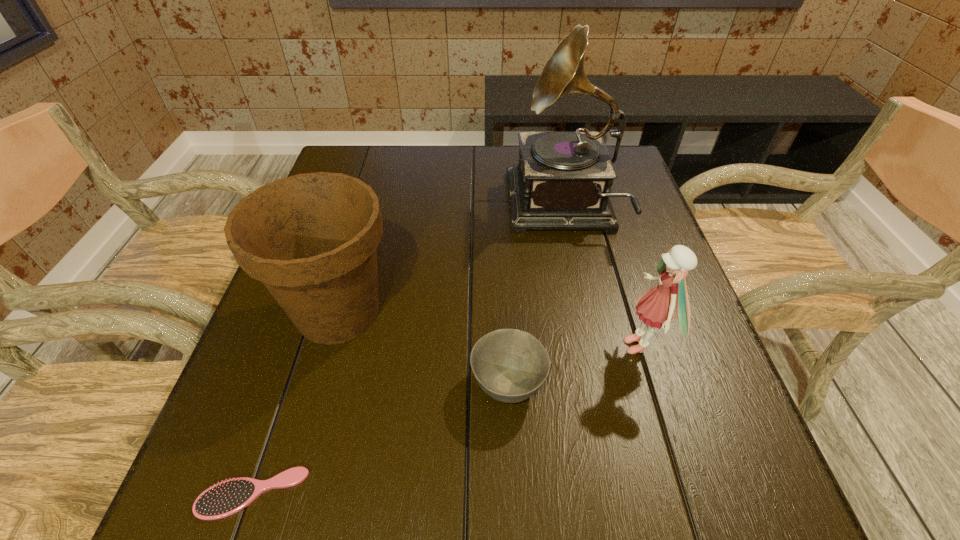
I want to click on record player at the right edge, so click(x=563, y=181).

Locate an element on the screen. This screenshot has width=960, height=540. doll situated at the right edge is located at coordinates (657, 306).

Identify the location of object at the near left corner. The height and width of the screenshot is (540, 960). (228, 497).

This screenshot has width=960, height=540. I want to click on object present at the far right corner, so click(x=563, y=181).

In the image, there is a desktop. Find the location of `free space at the far edge`. free space at the far edge is located at coordinates (482, 156).

You are a GUI agent. You are given a task and a screenshot of the screen. Output one action in this format:
    pyautogui.click(x=<x>, y=<y>)
    Task: Click on the free space at the near edge of the desktop
    This screenshot has width=960, height=540.
    Given the screenshot: What is the action you would take?
    pyautogui.click(x=323, y=492)

In the image, there is a desktop. Where is `free space at the left edge`? The width and height of the screenshot is (960, 540). free space at the left edge is located at coordinates (299, 339).

Identify the location of blank space at the right edge of the desktop. The width and height of the screenshot is (960, 540). (687, 417).

This screenshot has width=960, height=540. In order to click on free space at the far left corner of the desktop in this screenshot , I will do `click(346, 155)`.

The width and height of the screenshot is (960, 540). I want to click on vacant space in between the flowerpot and the record player, so click(x=450, y=260).